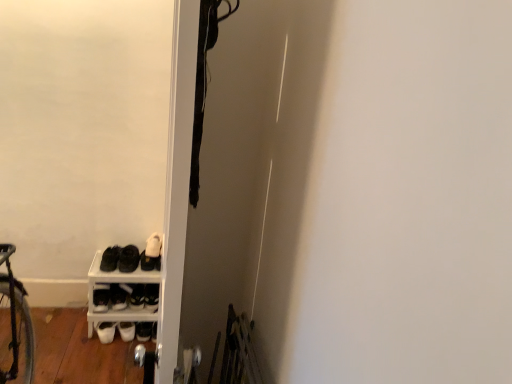
Question: From a real-world perspective, is white matte shoe at lower left, the third footwear viewed from the left, under black matte shoes at lower left, which is the second footwear from left to right?

Choices:
 (A) no
 (B) yes

Answer: (B)

Question: Considering the relative sizes of white matte shoe at lower left, the third footwear viewed from the left, and black matte shoes at lower left, which appears as the third footwear when viewed from the right, in the image provided, is white matte shoe at lower left, the third footwear viewed from the left, taller than black matte shoes at lower left, which appears as the third footwear when viewed from the right,?

Choices:
 (A) no
 (B) yes

Answer: (A)

Question: Are white matte shoe at lower left, the third footwear viewed from the left, and black matte shoes at lower left, which is the second footwear from left to right, located far from each other?

Choices:
 (A) no
 (B) yes

Answer: (A)

Question: Is white matte shoe at lower left, which ranks as the second footwear in right-to-left order, wider than black matte shoes at lower left, which appears as the third footwear when viewed from the right?

Choices:
 (A) yes
 (B) no

Answer: (B)

Question: Does white matte shoe at lower left, which ranks as the second footwear in right-to-left order, have a lesser height compared to black matte shoes at lower left, which appears as the third footwear when viewed from the right?

Choices:
 (A) yes
 (B) no

Answer: (A)

Question: Is white matte shoe at lower left, which ranks as the second footwear in right-to-left order, thinner than black matte shoes at lower left, which appears as the third footwear when viewed from the right?

Choices:
 (A) no
 (B) yes

Answer: (B)

Question: From the image's perspective, is black matte shoes at lower left, which appears as the third footwear when viewed from the right, on white matte sneakers at lower left, the first footwear viewed from the left?

Choices:
 (A) no
 (B) yes

Answer: (B)

Question: Is black matte shoes at lower left, which is the second footwear from left to right, to the right of white matte sneakers at lower left, positioned as the fourth footwear in right-to-left order, from the viewer's perspective?

Choices:
 (A) no
 (B) yes

Answer: (B)

Question: Does black matte shoes at lower left, which appears as the third footwear when viewed from the right, appear on the left side of white matte sneakers at lower left, positioned as the fourth footwear in right-to-left order?

Choices:
 (A) yes
 (B) no

Answer: (B)

Question: Is the position of black matte shoes at lower left, which is the second footwear from left to right, more distant than that of white matte sneakers at lower left, positioned as the fourth footwear in right-to-left order?

Choices:
 (A) yes
 (B) no

Answer: (B)

Question: Is black matte shoes at lower left, which is the second footwear from left to right, turned away from white matte sneakers at lower left, the first footwear viewed from the left?

Choices:
 (A) no
 (B) yes

Answer: (A)

Question: Is black matte shoes at lower left, which appears as the third footwear when viewed from the right, taller than white matte sneakers at lower left, the first footwear viewed from the left?

Choices:
 (A) yes
 (B) no

Answer: (A)

Question: Can white matte shoe at lower left, the third footwear viewed from the left, be found inside white matte sneakers at lower left, positioned as the fourth footwear in right-to-left order?

Choices:
 (A) no
 (B) yes

Answer: (A)